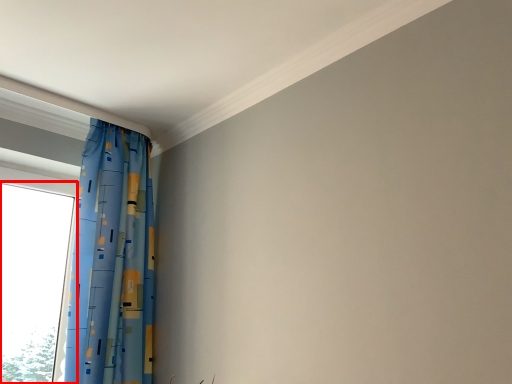
Question: From the image, what is the correct spatial relationship of window (annotated by the red box) in relation to curtain?

Choices:
 (A) left
 (B) right

Answer: (A)